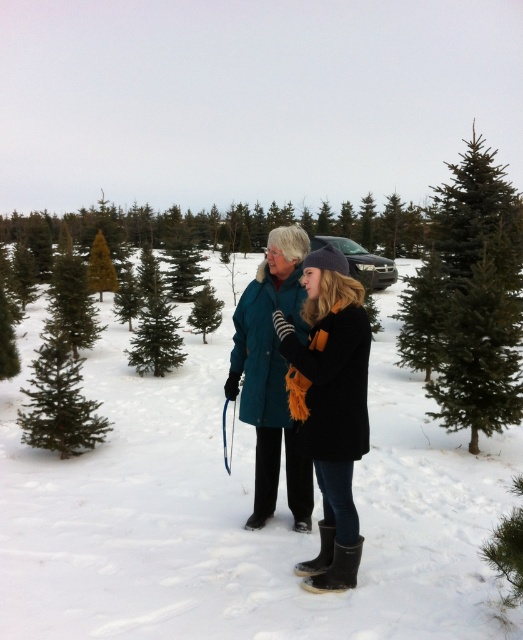
Question: Among these points, which one is nearest to the camera?

Choices:
 (A) (511, 336)
 (B) (309, 484)
 (C) (166, 396)
 (D) (19, 420)

Answer: (B)

Question: Is teal wool coat at center smaller than green needle-like fir tree at upper right?

Choices:
 (A) yes
 (B) no

Answer: (A)

Question: Among these objects, which one is farthest from the camera?

Choices:
 (A) green needle-like fir tree at upper right
 (B) green matte/fir tree at left
 (C) white fluffy snow at center
 (D) teal wool coat at center

Answer: (B)

Question: Which point appears closest to the camera in this image?

Choices:
 (A) click(480, 285)
 (B) click(224, 500)
 (C) click(248, 314)

Answer: (C)

Question: Does teal wool coat at center appear on the left side of green matte/fir tree at left?

Choices:
 (A) yes
 (B) no

Answer: (B)

Question: Observing the image, what is the correct spatial positioning of teal wool coat at center in reference to green matte/fir tree at left?

Choices:
 (A) left
 (B) right

Answer: (B)